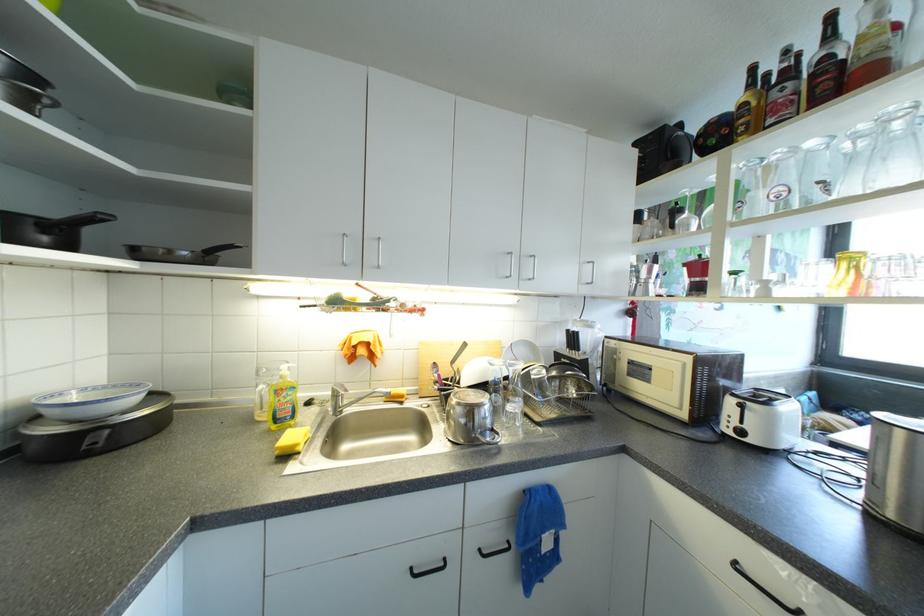
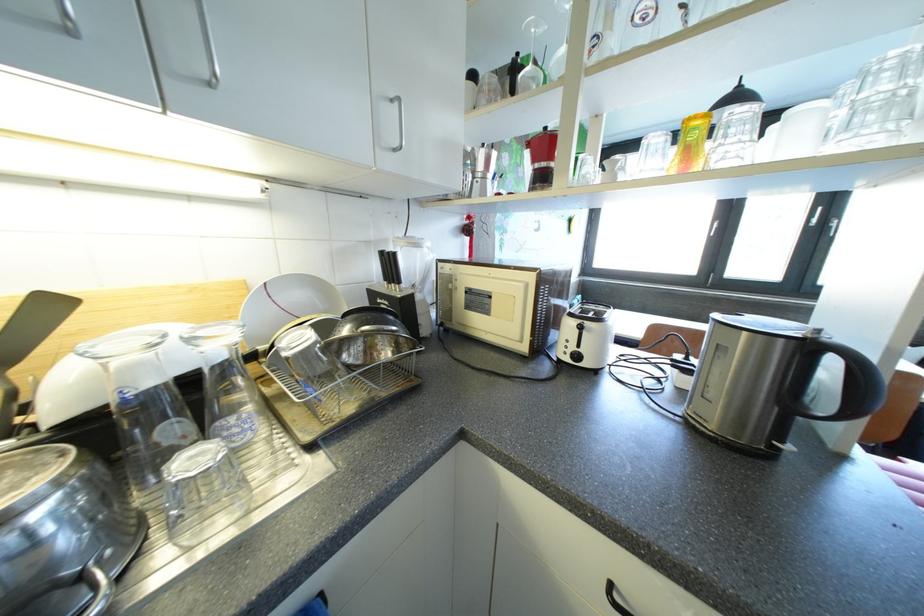
Locate, in the second image, the point that corresponds to the point at 527,354 in the first image.

(300, 299)